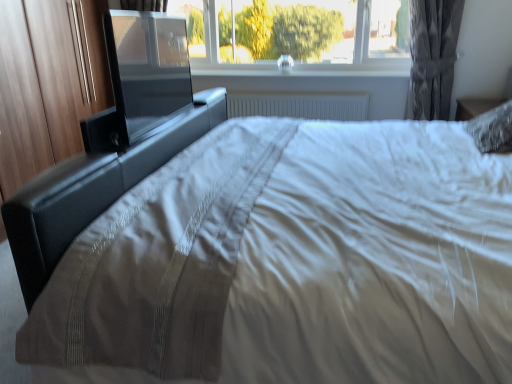
Question: From a real-world perspective, does gray textured curtain at upper right stand above black leather bed frame at center?

Choices:
 (A) no
 (B) yes

Answer: (B)

Question: Can you confirm if gray textured curtain at upper right is smaller than black leather bed frame at center?

Choices:
 (A) no
 (B) yes

Answer: (B)

Question: Is gray textured curtain at upper right completely or partially outside of black leather bed frame at center?

Choices:
 (A) no
 (B) yes

Answer: (B)

Question: Is black leather bed frame at center at the back of gray textured curtain at upper right?

Choices:
 (A) yes
 (B) no

Answer: (B)

Question: Considering the relative sizes of gray textured curtain at upper right and black leather bed frame at center in the image provided, is gray textured curtain at upper right taller than black leather bed frame at center?

Choices:
 (A) no
 (B) yes

Answer: (B)

Question: Is gray textured curtain at upper right in front of or behind white plastic radiator at center in the image?

Choices:
 (A) front
 (B) behind

Answer: (A)

Question: Is gray textured curtain at upper right to the left or to the right of white plastic radiator at center in the image?

Choices:
 (A) right
 (B) left

Answer: (A)

Question: From a real-world perspective, is gray textured curtain at upper right positioned above or below white plastic radiator at center?

Choices:
 (A) above
 (B) below

Answer: (A)

Question: Considering the positions of gray textured curtain at upper right and white plastic radiator at center in the image, is gray textured curtain at upper right wider or thinner than white plastic radiator at center?

Choices:
 (A) thin
 (B) wide

Answer: (B)

Question: Which is correct: black glossy screen door at upper left is inside white plastic radiator at center, or outside of it?

Choices:
 (A) outside
 (B) inside

Answer: (A)

Question: Considering the positions of black glossy screen door at upper left and white plastic radiator at center in the image, is black glossy screen door at upper left wider or thinner than white plastic radiator at center?

Choices:
 (A) wide
 (B) thin

Answer: (A)

Question: From the image's perspective, is black glossy screen door at upper left positioned above or below white plastic radiator at center?

Choices:
 (A) below
 (B) above

Answer: (A)

Question: From a real-world perspective, relative to white plastic radiator at center, is black glossy screen door at upper left vertically above or below?

Choices:
 (A) below
 (B) above

Answer: (B)

Question: Considering the positions of point (208, 125) and point (448, 19), is point (208, 125) closer or farther from the camera than point (448, 19)?

Choices:
 (A) farther
 (B) closer

Answer: (B)

Question: Visually, is black leather bed frame at center positioned to the left or to the right of gray textured curtain at upper right?

Choices:
 (A) right
 (B) left

Answer: (B)